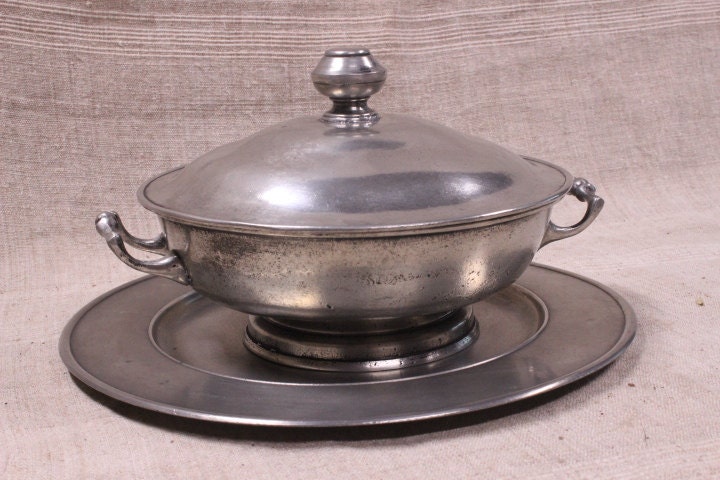
Locate an element on the screen. dish is located at coordinates (343, 399).